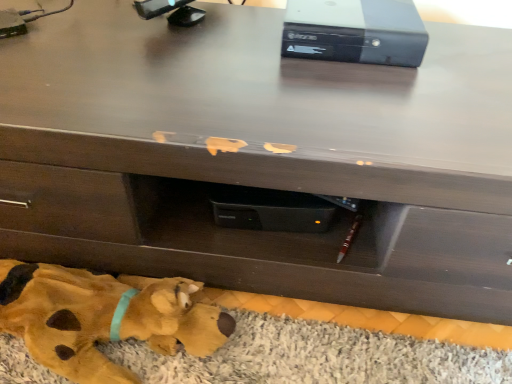
Question: From a real-world perspective, is yellow fabric mat at lower left physically below black plastic computer at upper center?

Choices:
 (A) no
 (B) yes

Answer: (B)

Question: Are yellow fabric mat at lower left and black plastic computer at upper center located far from each other?

Choices:
 (A) yes
 (B) no

Answer: (B)

Question: From the image's perspective, is yellow fabric mat at lower left located above black plastic computer at upper center?

Choices:
 (A) no
 (B) yes

Answer: (A)

Question: Considering the relative positions of yellow fabric mat at lower left and black plastic computer at upper center in the image provided, is yellow fabric mat at lower left to the left of black plastic computer at upper center from the viewer's perspective?

Choices:
 (A) yes
 (B) no

Answer: (A)

Question: Is yellow fabric mat at lower left positioned before black plastic computer at upper center?

Choices:
 (A) yes
 (B) no

Answer: (A)

Question: Looking at the image, does yellow plush toy at lower left seem bigger or smaller compared to black plastic computer at upper center?

Choices:
 (A) big
 (B) small

Answer: (A)

Question: Is yellow plush toy at lower left inside the boundaries of black plastic computer at upper center, or outside?

Choices:
 (A) outside
 (B) inside

Answer: (A)

Question: In terms of height, does yellow plush toy at lower left look taller or shorter compared to black plastic computer at upper center?

Choices:
 (A) tall
 (B) short

Answer: (A)

Question: Considering the positions of yellow plush toy at lower left and black plastic computer at upper center in the image, is yellow plush toy at lower left wider or thinner than black plastic computer at upper center?

Choices:
 (A) wide
 (B) thin

Answer: (B)

Question: From a real-world perspective, is black plastic computer at upper center positioned above or below yellow plush toy at lower left?

Choices:
 (A) above
 (B) below

Answer: (A)

Question: Relative to yellow plush toy at lower left, is black plastic computer at upper center in front or behind?

Choices:
 (A) front
 (B) behind

Answer: (B)

Question: Looking at their shapes, would you say black plastic computer at upper center is wider or thinner than yellow plush toy at lower left?

Choices:
 (A) thin
 (B) wide

Answer: (B)

Question: Is black plastic computer at upper center inside or outside of yellow plush toy at lower left?

Choices:
 (A) outside
 (B) inside

Answer: (A)

Question: Is yellow plush toy at lower left in front of or behind yellow fabric mat at lower left in the image?

Choices:
 (A) front
 (B) behind

Answer: (A)

Question: From the image's perspective, is yellow plush toy at lower left positioned above or below yellow fabric mat at lower left?

Choices:
 (A) below
 (B) above

Answer: (B)